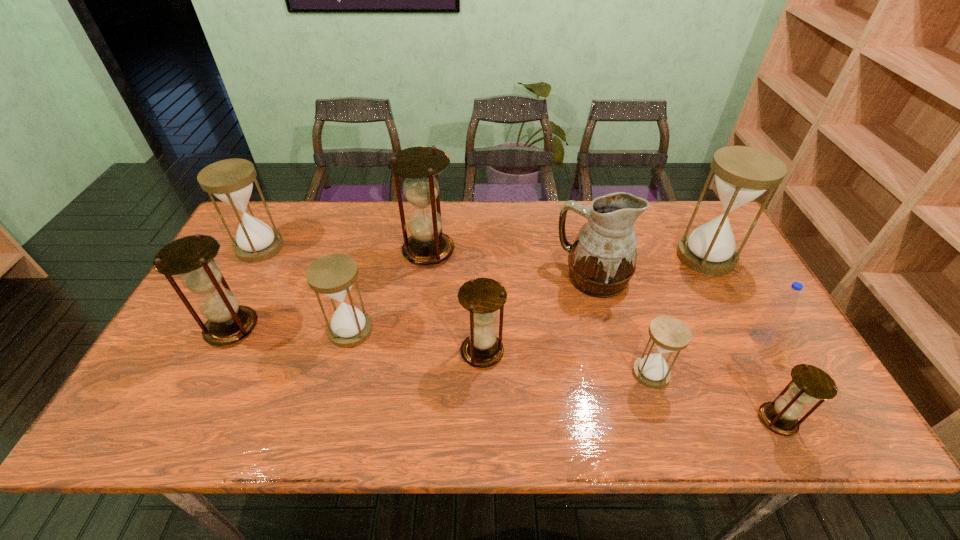
Where is `vacant space located 0.280m on the right of the second biggest white hourglass`? This screenshot has width=960, height=540. vacant space located 0.280m on the right of the second biggest white hourglass is located at coordinates (x=372, y=247).

Find the location of a particular element. vacant space positioned 0.330m on the back of the second biggest brown hourglass is located at coordinates (280, 231).

In order to click on free space located on the right of the second smallest brown hourglass in this screenshot , I will do `click(620, 352)`.

You are a GUI agent. You are given a task and a screenshot of the screen. Output one action in this format:
    pyautogui.click(x=<x>, y=<y>)
    Task: Click on the vacant region located on the right of the third white hourglass from right to left
    Image resolution: width=960 pixels, height=540 pixels.
    Given the screenshot: What is the action you would take?
    pyautogui.click(x=453, y=330)

At what (x,y) coordinates should I click in order to perform the action: click on free space located on the back of the blue water bottle. Please return your answer as a coordinate pair (x, y). The width and height of the screenshot is (960, 540). Looking at the image, I should click on (720, 263).

Identify the location of vacant region located 0.080m on the left of the third hourglass from right to left. This screenshot has height=540, width=960. (599, 373).

Where is `free region located on the left of the smallest brown hourglass`? free region located on the left of the smallest brown hourglass is located at coordinates (640, 420).

Where is `object that is at the near edge`? This screenshot has height=540, width=960. object that is at the near edge is located at coordinates (809, 383).

The image size is (960, 540). I want to click on water bottle present at the right edge, so click(x=772, y=321).

Where is `object present at the far left corner`? object present at the far left corner is located at coordinates (231, 180).